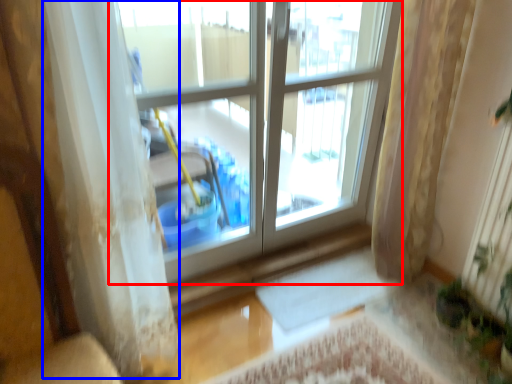
Question: Which of the following is the farthest to the observer, window (highlighted by a red box) or curtain (highlighted by a blue box)?

Choices:
 (A) window
 (B) curtain

Answer: (A)